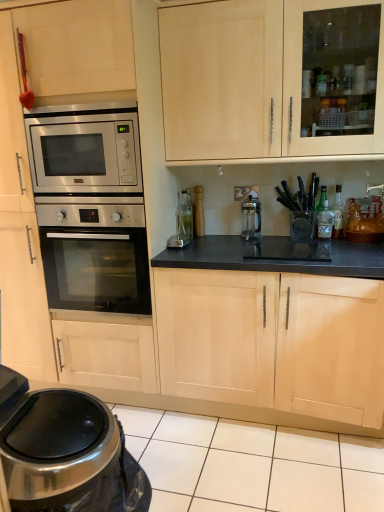
Question: From a real-world perspective, does metallic trash can at lower left sit lower than brushed metal faucet at upper right?

Choices:
 (A) yes
 (B) no

Answer: (A)

Question: Is metallic trash can at lower left directly adjacent to brushed metal faucet at upper right?

Choices:
 (A) no
 (B) yes

Answer: (A)

Question: Would you consider metallic trash can at lower left to be distant from brushed metal faucet at upper right?

Choices:
 (A) yes
 (B) no

Answer: (A)

Question: Is brushed metal faucet at upper right located within metallic trash can at lower left?

Choices:
 (A) no
 (B) yes

Answer: (A)

Question: From the image's perspective, is metallic trash can at lower left below brushed metal faucet at upper right?

Choices:
 (A) yes
 (B) no

Answer: (A)

Question: From the image's perspective, is metallic trash can at lower left on brushed metal faucet at upper right?

Choices:
 (A) no
 (B) yes

Answer: (A)

Question: From a real-world perspective, is clear glass bottle at center-right, the third bottle when ordered from right to left, physically above metallic trash can at lower left?

Choices:
 (A) no
 (B) yes

Answer: (B)

Question: Can we say clear glass bottle at center-right, the third bottle when ordered from right to left, lies outside metallic trash can at lower left?

Choices:
 (A) yes
 (B) no

Answer: (A)

Question: Is metallic trash can at lower left surrounded by clear glass bottle at center-right, the third bottle when ordered from right to left?

Choices:
 (A) no
 (B) yes

Answer: (A)

Question: Is clear glass bottle at center-right, the third bottle when ordered from right to left, taller than metallic trash can at lower left?

Choices:
 (A) yes
 (B) no

Answer: (B)

Question: Are clear glass bottle at center-right, the third bottle when ordered from right to left, and metallic trash can at lower left located far from each other?

Choices:
 (A) yes
 (B) no

Answer: (A)

Question: Is clear glass bottle at center-right, placed as the 1th bottle when sorted from left to right, turned away from metallic trash can at lower left?

Choices:
 (A) no
 (B) yes

Answer: (A)

Question: From the image's perspective, does metallic trash can at lower left appear higher than satin silver coffee maker at center?

Choices:
 (A) yes
 (B) no

Answer: (B)